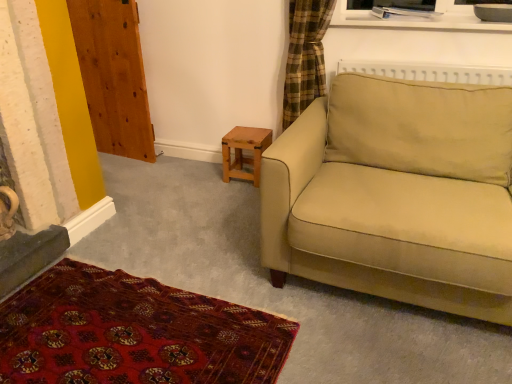
You are a GUI agent. You are given a task and a screenshot of the screen. Output one action in this format:
    pyautogui.click(x=<x>, y=<y>)
    Task: Click on the vacant region to the left of wooden stool at lower center
    The height and width of the screenshot is (384, 512).
    Given the screenshot: What is the action you would take?
    pyautogui.click(x=207, y=172)